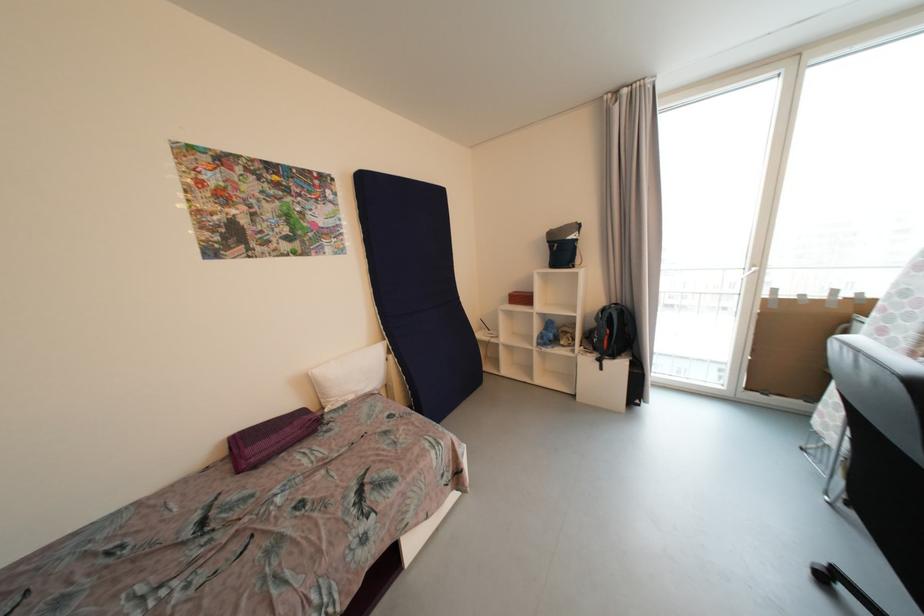
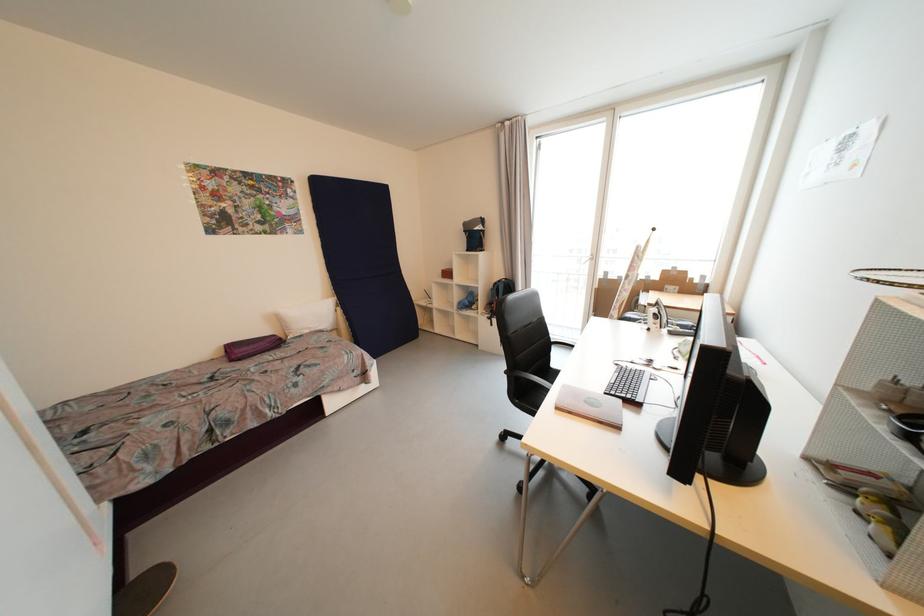
Locate, in the second image, the point that corresponds to pixel 516 293 in the first image.

(450, 270)